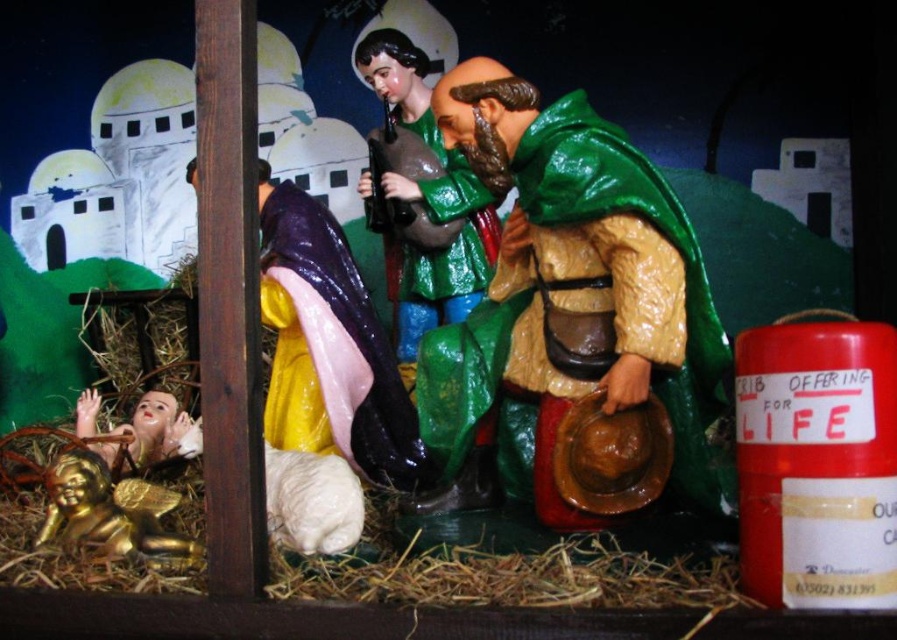
You are setting up a Christmas display and want to place the matte green figurine at center and the gold shiny angel at lower left exactly 20 inches apart. Based on their current positions, do you need to move them closer or farther apart?

The matte green figurine at center and gold shiny angel at lower left are currently 21.70 inches apart. Since 21.70 inches is more than 20 inches, you need to move them closer to achieve the desired distance.

In the nativity scene, you see a green glossy figure at center and a matte green figurine at center. Which one is bigger?

The green glossy figure at center is larger in size than the matte green figurine at center.